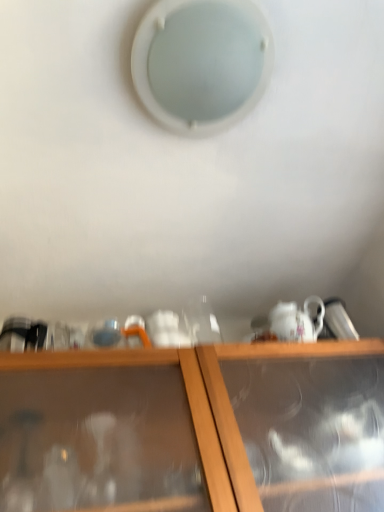
Question: Considering their positions, is wooden cabinet at lower center located in front of or behind white frosted glass hole at upper center?

Choices:
 (A) behind
 (B) front

Answer: (B)

Question: Based on their positions, is wooden cabinet at lower center located to the left or right of white frosted glass hole at upper center?

Choices:
 (A) left
 (B) right

Answer: (B)

Question: Is wooden cabinet at lower center bigger or smaller than white frosted glass hole at upper center?

Choices:
 (A) big
 (B) small

Answer: (A)

Question: Considering the positions of point (155, 110) and point (134, 501), is point (155, 110) closer or farther from the camera than point (134, 501)?

Choices:
 (A) farther
 (B) closer

Answer: (A)

Question: From the image's perspective, is white frosted glass hole at upper center positioned above or below wooden cabinet at lower center?

Choices:
 (A) below
 (B) above

Answer: (B)

Question: Is white frosted glass hole at upper center bigger or smaller than wooden cabinet at lower center?

Choices:
 (A) big
 (B) small

Answer: (B)

Question: From a real-world perspective, is white frosted glass hole at upper center positioned above or below wooden cabinet at lower center?

Choices:
 (A) below
 (B) above

Answer: (B)